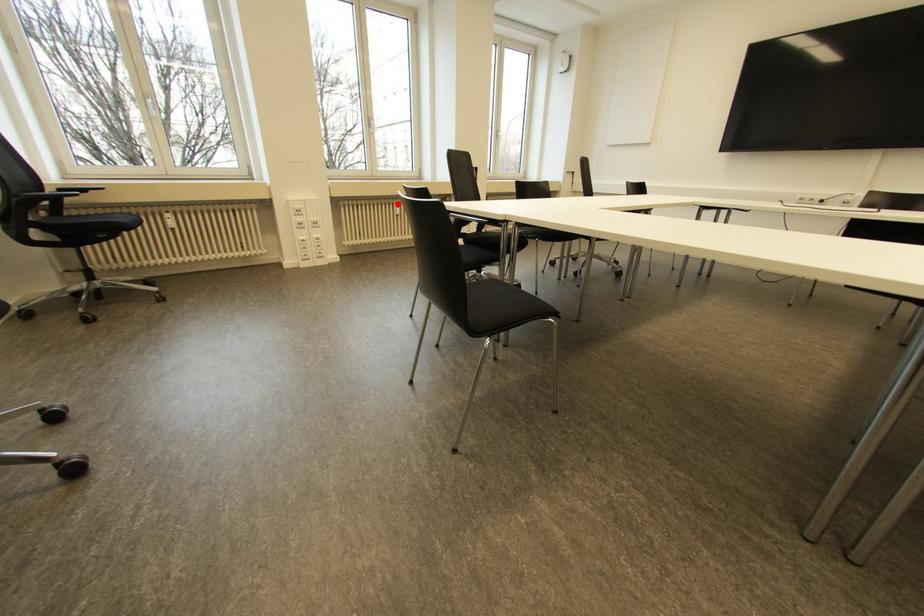
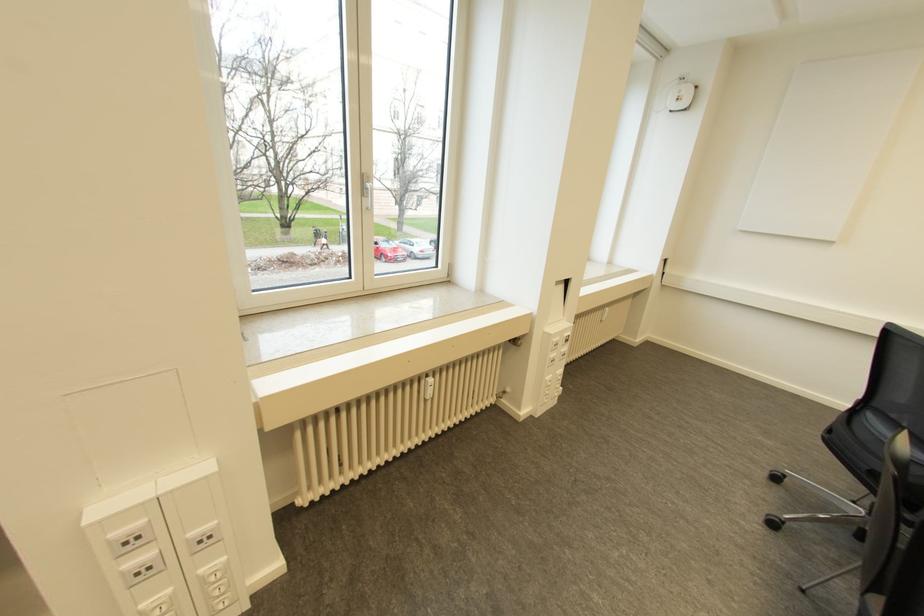
The point at the highlighted location is marked in the first image. Where is the corresponding point in the second image?

(430, 379)